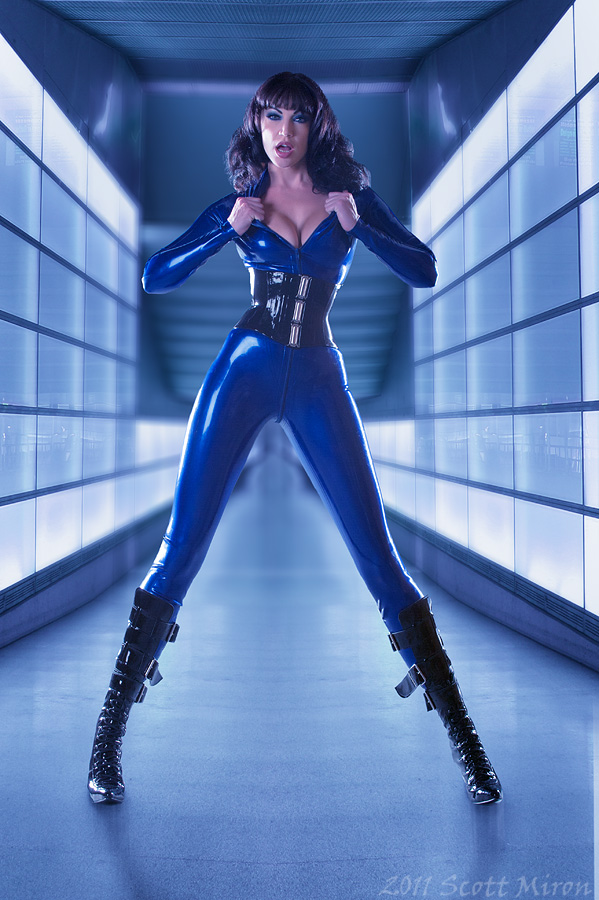
Where is `floor`? floor is located at coordinates (298, 727).